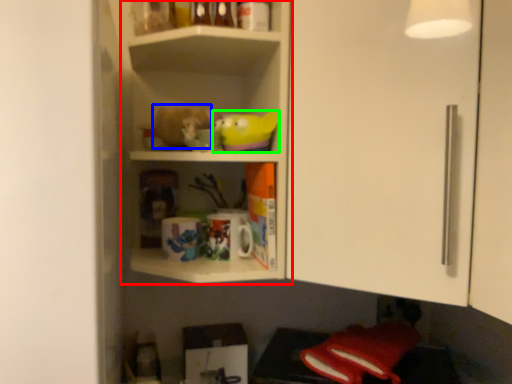
Question: Considering the real-world distances, which object is farthest from shelf (highlighted by a red box)? stuff (highlighted by a blue box) or toy (highlighted by a green box)?

Choices:
 (A) stuff
 (B) toy

Answer: (B)